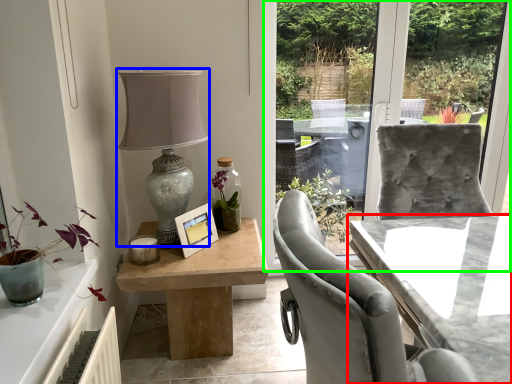
Question: Estimate the real-world distances between objects in this image. Which object is farther from table (highlighted by a red box), table lamp (highlighted by a blue box) or window screen (highlighted by a green box)?

Choices:
 (A) table lamp
 (B) window screen

Answer: (B)